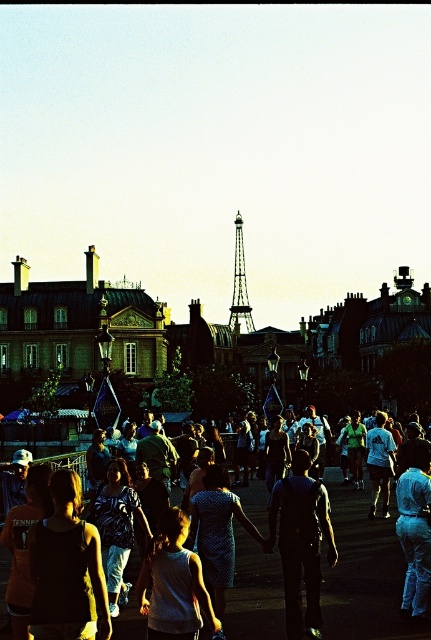
Question: Does matte blue dress at center have a greater width compared to metallic silver eiffel tower at center?

Choices:
 (A) no
 (B) yes

Answer: (B)

Question: Does matte blue dress at center have a larger size compared to metallic silver eiffel tower at center?

Choices:
 (A) yes
 (B) no

Answer: (A)

Question: Is matte blue dress at center to the right of metallic silver eiffel tower at center from the viewer's perspective?

Choices:
 (A) yes
 (B) no

Answer: (A)

Question: Which point appears farthest from the camera in this image?

Choices:
 (A) (346, 528)
 (B) (231, 321)

Answer: (B)

Question: Which point appears closest to the camera in this image?

Choices:
 (A) 244,310
 (B) 349,632

Answer: (B)

Question: Which object is closer to the camera taking this photo?

Choices:
 (A) metallic silver eiffel tower at center
 (B) matte blue dress at center

Answer: (B)